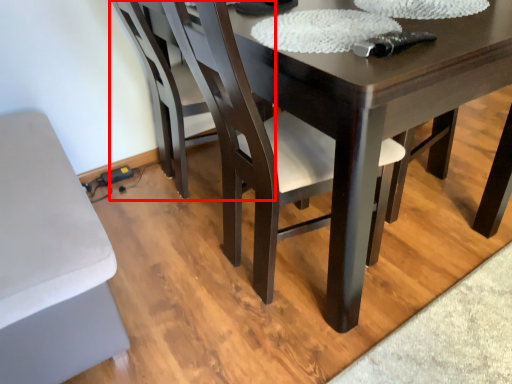
Question: From the image's perspective, what is the correct spatial relationship of chair (annotated by the red box) in relation to chair?

Choices:
 (A) below
 (B) above

Answer: (B)